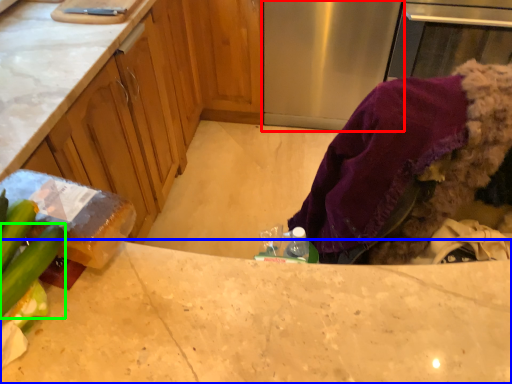
Question: Which is nearer to the appliance (highlighted by a red box)? countertop (highlighted by a blue box) or cucumber (highlighted by a green box).

Choices:
 (A) countertop
 (B) cucumber

Answer: (A)